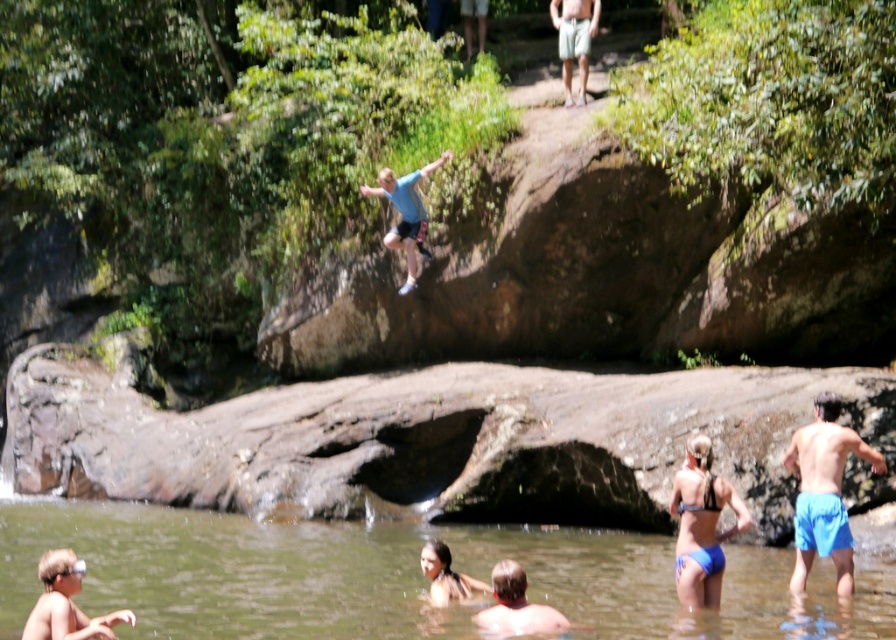
Does greenish-brown water at lower center appear on the right side of green cotton shorts at upper center?

In fact, greenish-brown water at lower center is to the left of green cotton shorts at upper center.

Between point (173, 516) and point (583, 84), which one is positioned behind?

Positioned behind is point (583, 84).

Is point (632, 614) positioned after point (579, 40)?

No, (632, 614) is in front of (579, 40).

Find the location of a particular element. The width and height of the screenshot is (896, 640). greenish-brown water at lower center is located at coordinates (401, 577).

You are a GUI agent. You are given a task and a screenshot of the screen. Output one action in this format:
    pyautogui.click(x=<x>, y=<y>)
    Task: Click on the blue fabric shorts at lower right
    This screenshot has height=640, width=896.
    Given the screenshot: What is the action you would take?
    [824, 492]

Is blue fabric shorts at lower right positioned at the back of green cotton shorts at upper center?

No, it is not.

Locate an element on the screen. blue fabric shorts at lower right is located at coordinates pyautogui.click(x=824, y=492).

The image size is (896, 640). In order to click on blue fabric shorts at lower right in this screenshot , I will do `click(824, 492)`.

Can you confirm if smooth skin boy at lower left is positioned below light blue t-shirt at center?

Yes.

Which is behind, point (70, 570) or point (435, 161)?

The point (435, 161) is behind.

Which is in front, point (108, 620) or point (420, 236)?

Point (108, 620) is in front.

Where is `smooth skin boy at lower left`? This screenshot has height=640, width=896. smooth skin boy at lower left is located at coordinates (66, 604).